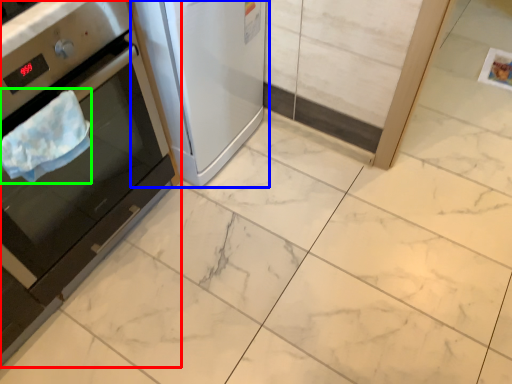
Question: Considering the real-world distances, which object is farthest from home appliance (highlighted by a red box)? home appliance (highlighted by a blue box) or blanket (highlighted by a green box)?

Choices:
 (A) home appliance
 (B) blanket

Answer: (A)